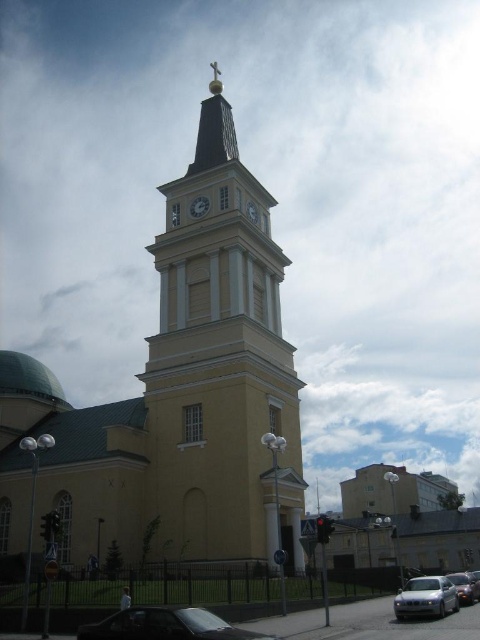
Question: Is metallic silver car at lower right to the right of matte white clock at center from the viewer's perspective?

Choices:
 (A) no
 (B) yes

Answer: (B)

Question: Does white glossy clock at upper center have a lesser width compared to matte white clock at center?

Choices:
 (A) no
 (B) yes

Answer: (A)

Question: Which object appears closest to the camera in this image?

Choices:
 (A) matte white clock at center
 (B) shiny black car at lower left
 (C) white glossy clock at center

Answer: (B)

Question: Among these points, which one is farthest from the camera?

Choices:
 (A) (207, 634)
 (B) (456, 580)

Answer: (B)

Question: Which object appears farthest from the camera in this image?

Choices:
 (A) shiny black car at lower left
 (B) metallic silver car at lower right
 (C) white glossy clock at center
 (D) silver metallic car at lower right

Answer: (C)

Question: Does yellow matte tower at center have a lesser width compared to white glossy clock at upper center?

Choices:
 (A) no
 (B) yes

Answer: (A)